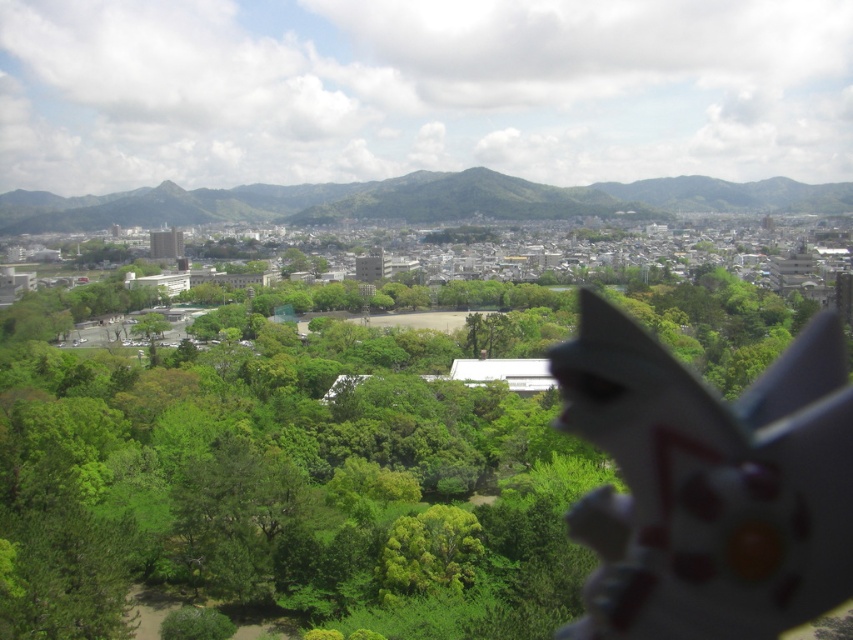
Question: Which object appears farthest from the camera in this image?

Choices:
 (A) green leafy tree at center
 (B) green textured mountain at upper center

Answer: (B)

Question: Which object is closer to the camera taking this photo?

Choices:
 (A) green leafy tree at center
 (B) green textured mountain at upper center

Answer: (A)

Question: Is green leafy tree at center to the right of green textured mountain at upper center from the viewer's perspective?

Choices:
 (A) no
 (B) yes

Answer: (B)

Question: Is green leafy tree at center thinner than green textured mountain at upper center?

Choices:
 (A) no
 (B) yes

Answer: (B)

Question: Which object is closer to the camera taking this photo?

Choices:
 (A) green textured mountain at upper center
 (B) green leafy tree at center

Answer: (B)

Question: Can you confirm if green leafy tree at center is positioned to the right of green textured mountain at upper center?

Choices:
 (A) no
 (B) yes

Answer: (B)